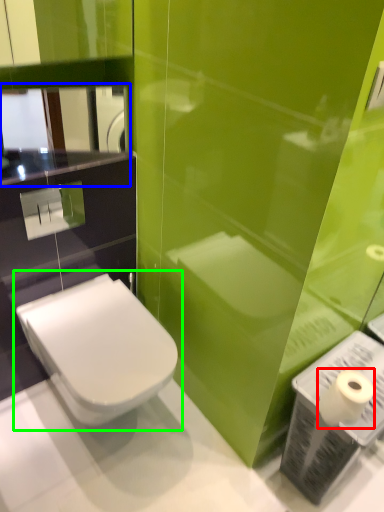
Question: Which object is positioned farthest from toilet paper (highlighted by a red box)? Select from mirror (highlighted by a blue box) and toilet (highlighted by a green box).

Choices:
 (A) mirror
 (B) toilet

Answer: (A)